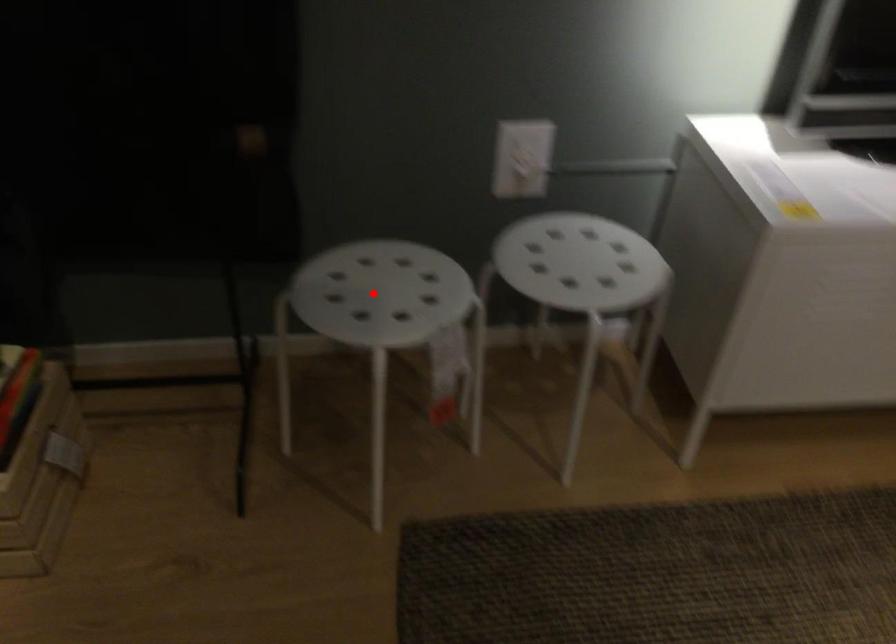
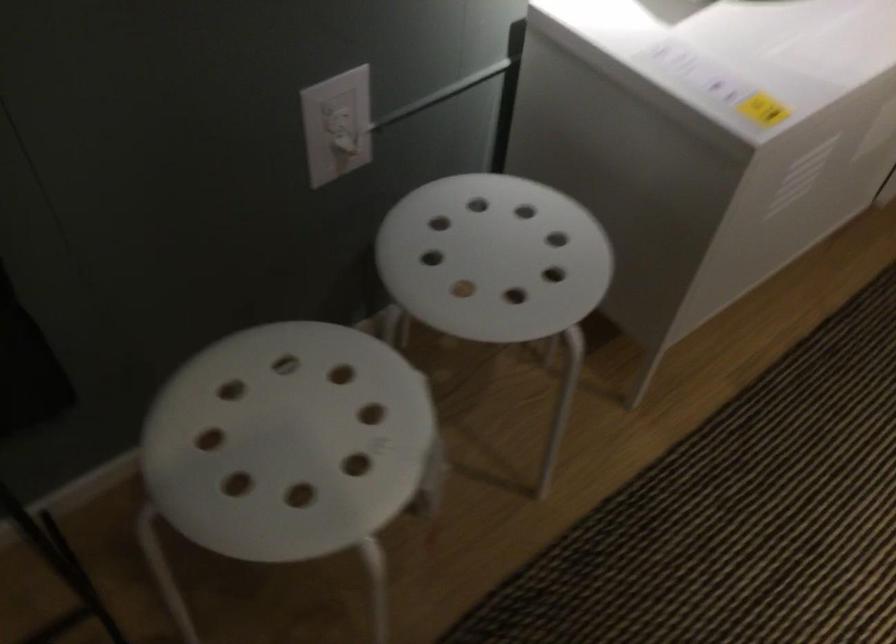
Where in the second image is the point corresponding to the highlighted location from the first image?

(288, 442)